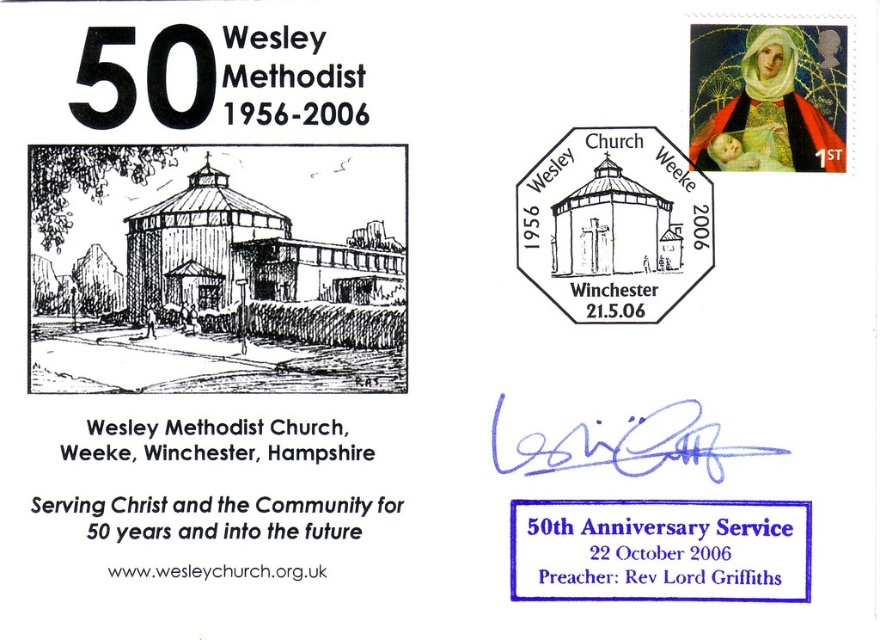
Is white paper stamp at upper center positioned behind blue ink signature at center?

Yes, it is.

Is point (669, 196) behind point (642, 426)?

Yes, it is behind point (642, 426).

Where is `white paper stamp at upper center`? The width and height of the screenshot is (880, 640). white paper stamp at upper center is located at coordinates (614, 225).

Who is taller, blue ink signature at lower center or blue ink signature at center?

Standing taller between the two is blue ink signature at lower center.

Is blue ink signature at lower center to the right of blue ink signature at center from the viewer's perspective?

Correct, you'll find blue ink signature at lower center to the right of blue ink signature at center.

Is point (779, 509) farther from camera compared to point (692, 445)?

No, (779, 509) is in front of (692, 445).

Find the location of `blue ink signature at lower center`. blue ink signature at lower center is located at coordinates (660, 548).

Can you confirm if white paper stamp at upper center is smaller than blue ink signature at lower center?

Correct, white paper stamp at upper center occupies less space than blue ink signature at lower center.

Between point (580, 234) and point (697, 520), which one is positioned in front?

Point (697, 520) is in front.

Which is behind, point (561, 237) or point (739, 593)?

The point (561, 237) is behind.

The height and width of the screenshot is (640, 880). Identify the location of white paper stamp at upper center. click(614, 225).